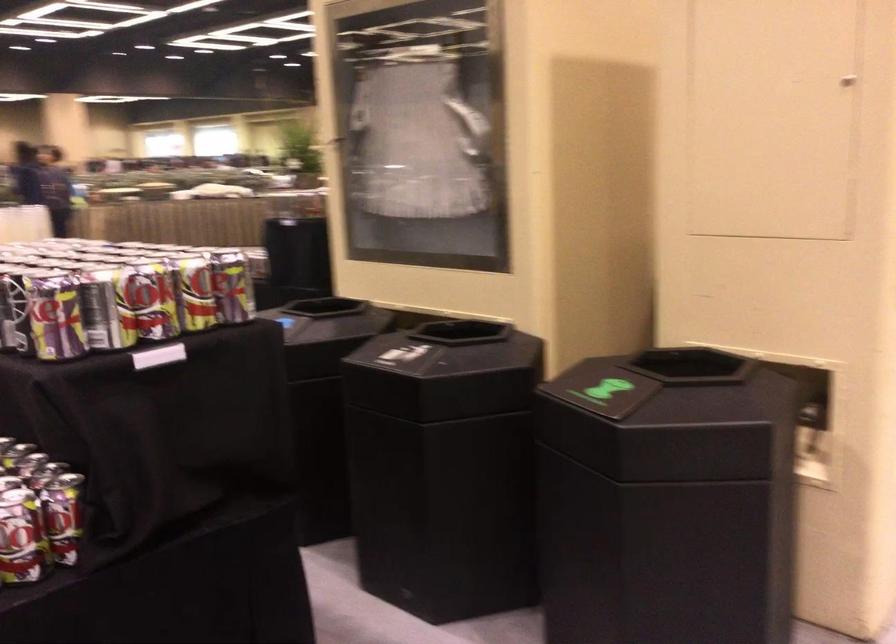
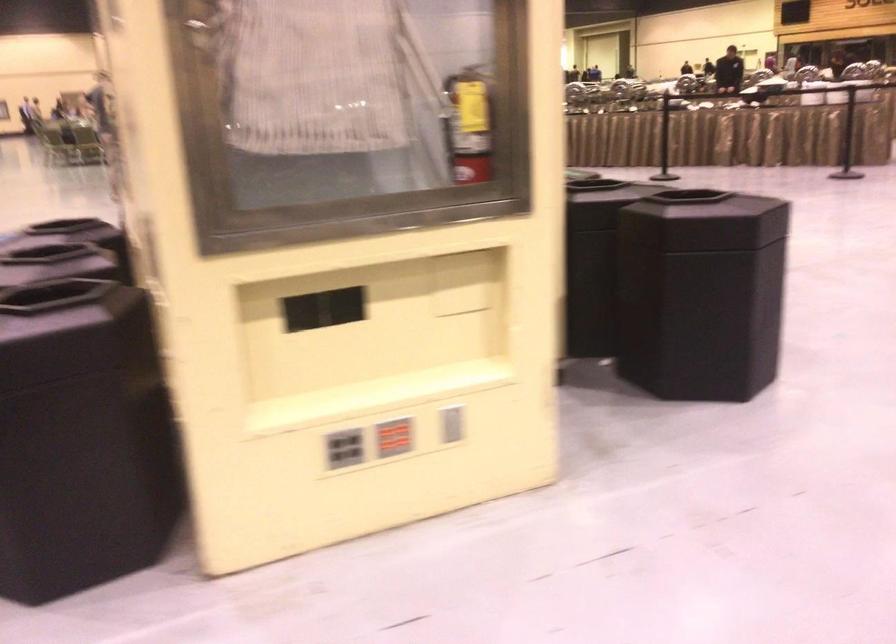
Question: What movement of the cameraman would produce the second image?

Choices:
 (A) Left
 (B) Right
 (C) Forward
 (D) Backward

Answer: (B)